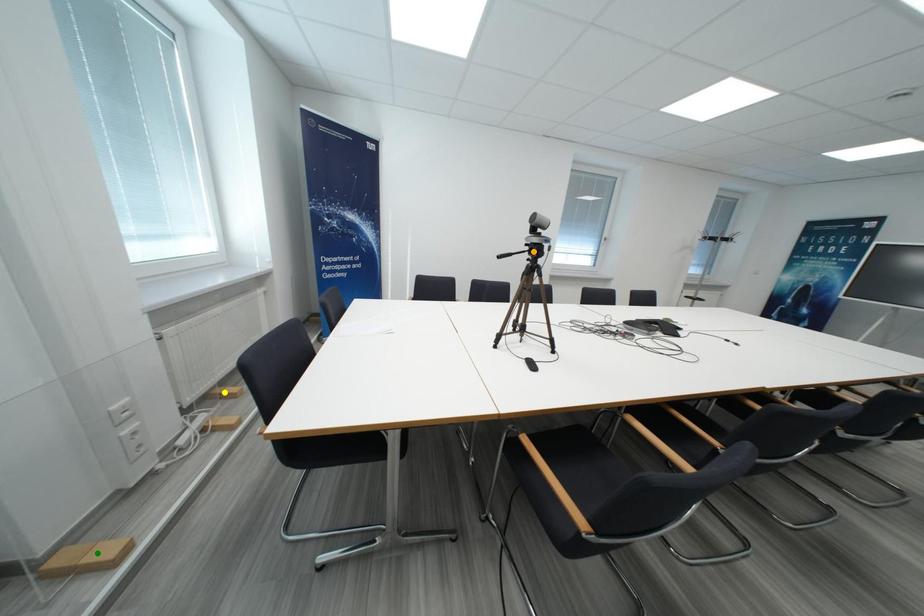
Order these from farthest to nearest:
1. orange point
2. green point
3. yellow point

yellow point < orange point < green point